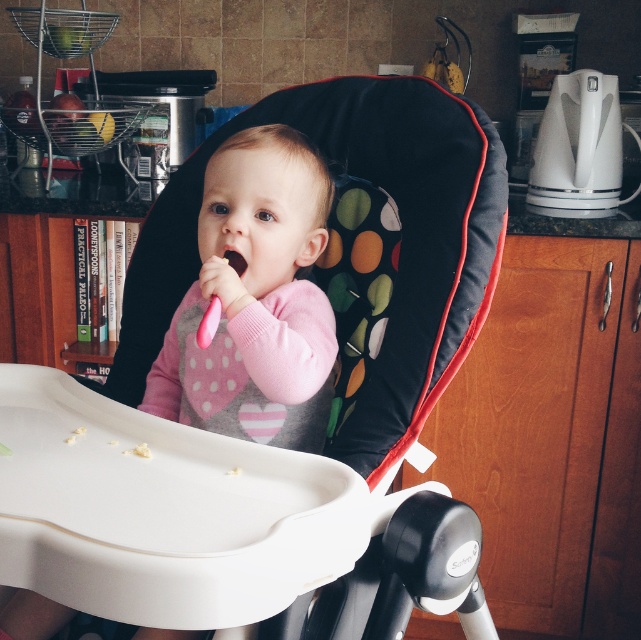
You are a parent trying to hand your baby a toy. The baby is currently holding a pink spoon on the high chair tray. You see the pink soft toy at center and the pink rubber toothbrush at center. Which item is closer to the baby?

The pink soft toy at center is closer to the baby than the pink rubber toothbrush at center because the distance between them is 5.46 inches.

You are a parent trying to place a new toy on the table next to the black fabric highchair at center and the pink soft toy at center. Which object should you move to make space?

The pink soft toy at center should be moved because it is shorter than the black fabric highchair at center, making it easier to relocate for space.

You are a parent trying to clean up the kitchen. You see the black fabric highchair at center and the pink rubber toothbrush at center. Which object is located to the right of the other?

The black fabric highchair at center is to the right of the pink rubber toothbrush at center.